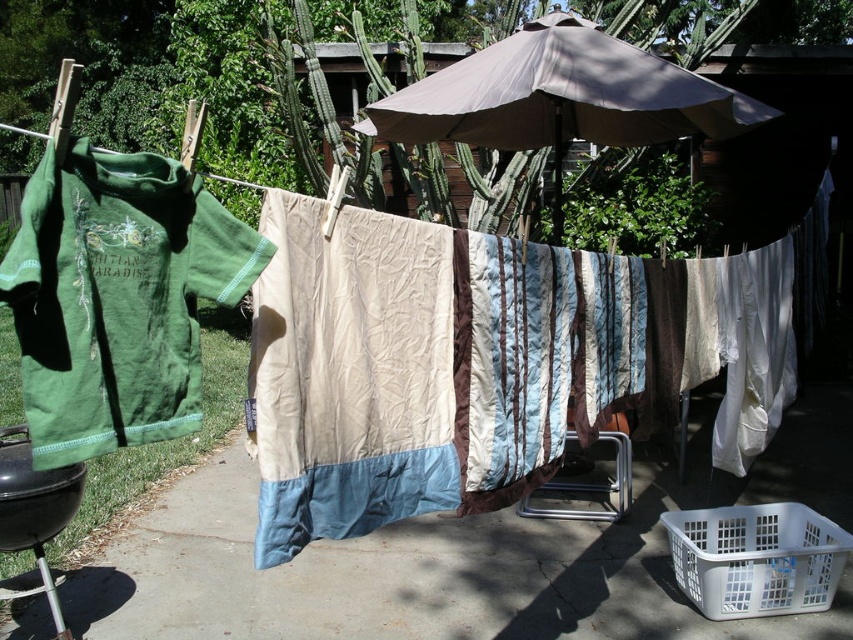
You are a painter who needs to place a 1.2 meter tall ladder in the scene. Given that the smooth concrete pavement at center and the white plastic basket at lower right are present, which object should the ladder be placed next to to ensure it doesn

The smooth concrete pavement at center is shorter than the white plastic basket at lower right. Therefore, the ladder should be placed next to the white plastic basket at lower right since it is taller and can provide a stable base.

In the scene shown: You are standing in the outdoor laundry area and want to take a photo of the clothesline. You notice two points marked as point 1 at coordinate (x=453, y=436) and point 2 at coordinate (x=138, y=236). Which point should you focus on first if you want to ensure both points are in focus?

Point 1 at coordinate (x=453, y=436) is further to the camera than point 2 at coordinate (x=138, y=236). To ensure both points are in focus, you should focus on the closer point, which is point 2 at coordinate (x=138, y=236).